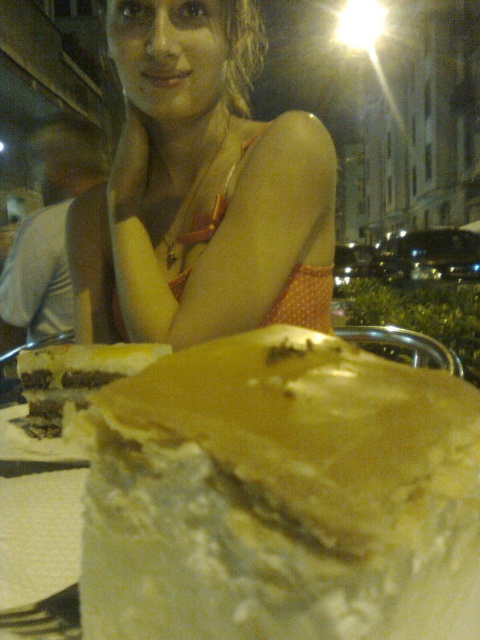
You are a photographer trying to capture both the white creamy cake at center and the orange polka dot dress at upper center in a single shot. Based on their heights, which object should you adjust your camera angle to focus on first?

The white creamy cake at center is shorter than the orange polka dot dress at upper center, so you should lower your camera angle to focus on the white creamy cake at center first before adjusting for the taller dress.

You are a photographer trying to capture a closeup of the white creamy cake at center. The camera you are using has a minimum focusing distance of 6 inches. Will you be able to take the photo without moving the cake closer?

The white creamy cake at center is 5.71 inches from the camera, which is less than the 6 inches minimum focusing distance. Therefore, the camera cannot focus properly. Move the cake slightly farther away to ensure it is within the minimum focusing distance.

You are planning to serve both the white creamy cake at center and the yellow cake at center to guests. Based on the image, which cake has a larger portion size?

The white creamy cake at center is bigger than the yellow cake at center, so it has a larger portion size.